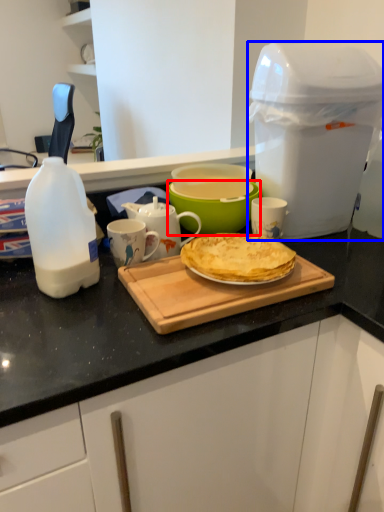
Question: Which point is further to the camera, bowl (highlighted by a red box) or appliance (highlighted by a blue box)?

Choices:
 (A) bowl
 (B) appliance

Answer: (A)